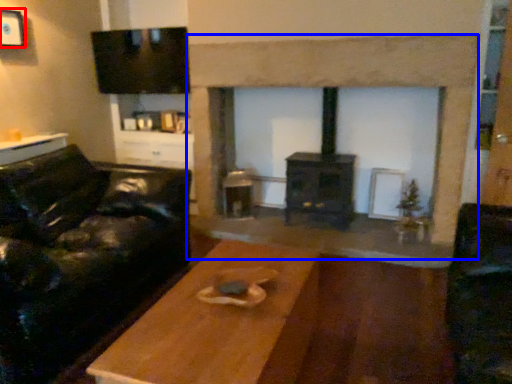
Question: Which object appears farthest to the camera in this image, picture frame (highlighted by a red box) or fireplace (highlighted by a blue box)?

Choices:
 (A) picture frame
 (B) fireplace

Answer: (A)